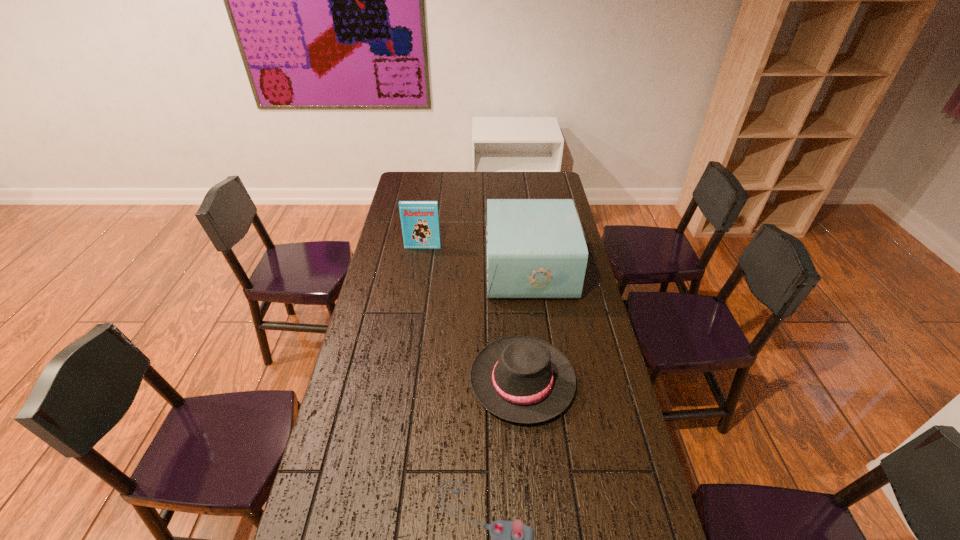
The height and width of the screenshot is (540, 960). I want to click on dress hat positioned at the right edge, so click(x=522, y=379).

Find the location of a particular element. The width and height of the screenshot is (960, 540). vacant region at the far edge of the desktop is located at coordinates (514, 187).

The width and height of the screenshot is (960, 540). I want to click on free space at the left edge of the desktop, so click(x=346, y=518).

The height and width of the screenshot is (540, 960). In the image, there is a desktop. Identify the location of vacant space at the far left corner. (415, 184).

In the image, there is a desktop. Identify the location of free space at the far right corner. (543, 183).

Identify the location of empty location between the book and the dress hat. The width and height of the screenshot is (960, 540). (472, 314).

You are a GUI agent. You are given a task and a screenshot of the screen. Output one action in this format:
    pyautogui.click(x=<x>, y=<y>)
    Task: Click on the vacant space that's between the second nearest object and the radio receiver
    The width and height of the screenshot is (960, 540).
    Given the screenshot: What is the action you would take?
    pyautogui.click(x=525, y=325)

Where is `vacant space that is in between the leftmost object and the radio receiver`? Image resolution: width=960 pixels, height=540 pixels. vacant space that is in between the leftmost object and the radio receiver is located at coordinates (476, 258).

Find the location of a particular element. Image resolution: width=960 pixels, height=540 pixels. free space that is in between the dress hat and the book is located at coordinates (472, 314).

Identify the location of vacant area between the book and the radio receiver. The height and width of the screenshot is (540, 960). (476, 258).